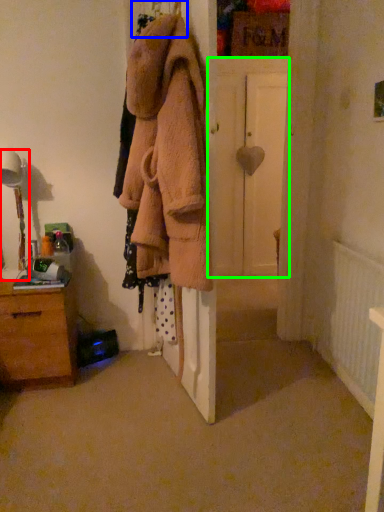
Question: Which is farther away from table lamp (highlighted by a red box)? hanger (highlighted by a blue box) or door (highlighted by a green box)?

Choices:
 (A) hanger
 (B) door

Answer: (B)